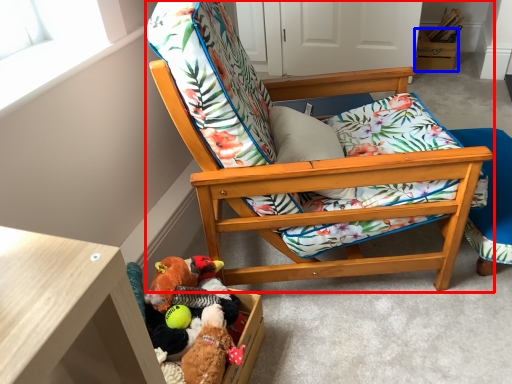
Question: Which point is further to the camera, chair (highlighted by a red box) or storage box (highlighted by a blue box)?

Choices:
 (A) chair
 (B) storage box

Answer: (B)